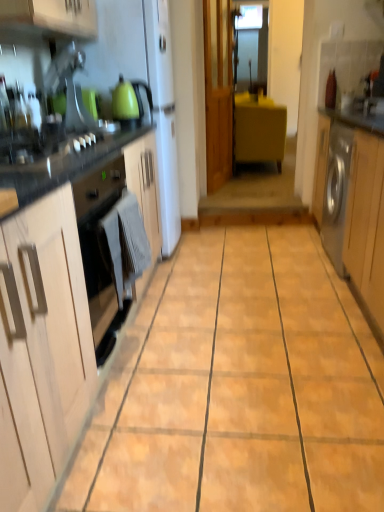
What do you see at coordinates (259, 129) in the screenshot?
I see `yellow matte cabinet at center, which ranks as the 3th cabinetry in front-to-back order` at bounding box center [259, 129].

Where is `silver metallic washing machine at right, the second cabinetry viewed from the back`? This screenshot has height=512, width=384. silver metallic washing machine at right, the second cabinetry viewed from the back is located at coordinates (353, 203).

What do you see at coordinates (124, 101) in the screenshot?
I see `matte green kettle at upper left` at bounding box center [124, 101].

You are a GUI agent. You are given a task and a screenshot of the screen. Output one action in this format:
    pyautogui.click(x=<x>, y=<y>)
    Task: Click on the light wood cabinet at left, the third cabinetry viewed from the right
    
    Given the screenshot: What is the action you would take?
    pyautogui.click(x=42, y=348)

Find the location of a particular element. yellow matte cabinet at center, which is the 1th cabinetry from top to bottom is located at coordinates (259, 129).

Does point (127, 102) come farther from viewer compared to point (377, 245)?

That is True.

From a real-world perspective, is matte green kettle at upper left above or below silver metallic washing machine at right, the 2th cabinetry ordered from the bottom?

matte green kettle at upper left is above silver metallic washing machine at right, the 2th cabinetry ordered from the bottom.

Can you confirm if matte green kettle at upper left is positioned to the left of silver metallic washing machine at right, the 2th cabinetry ordered from the bottom?

Yes, matte green kettle at upper left is to the left of silver metallic washing machine at right, the 2th cabinetry ordered from the bottom.

Does matte green kettle at upper left contain silver metallic washing machine at right, which is counted as the first cabinetry, starting from the right?

No, matte green kettle at upper left does not contain silver metallic washing machine at right, which is counted as the first cabinetry, starting from the right.

Does matte green kettle at upper left have a larger size compared to light wood cabinet at left, the third cabinetry positioned from the back?

No.

Consider the image. Would you say matte green kettle at upper left contains light wood cabinet at left, which appears as the first cabinetry when ordered from the bottom?

That's incorrect, light wood cabinet at left, which appears as the first cabinetry when ordered from the bottom, is not inside matte green kettle at upper left.

How many degrees apart are the facing directions of matte green kettle at upper left and light wood cabinet at left, marked as the third cabinetry in a top-to-bottom arrangement?

The angular difference between matte green kettle at upper left and light wood cabinet at left, marked as the third cabinetry in a top-to-bottom arrangement, is 2.98 degrees.

Looking at their sizes, would you say silver metallic washing machine at right, which is counted as the first cabinetry, starting from the right, is wider or thinner than gray fabric towel at lower left?

Clearly, silver metallic washing machine at right, which is counted as the first cabinetry, starting from the right, has more width compared to gray fabric towel at lower left.

From a real-world perspective, which object stands above the other?

gray fabric towel at lower left.

Are silver metallic washing machine at right, the 2th cabinetry in the front-to-back sequence, and gray fabric towel at lower left located far from each other?

Absolutely, silver metallic washing machine at right, the 2th cabinetry in the front-to-back sequence, is distant from gray fabric towel at lower left.

Locate an element on the screen. kitchen appliance lying on the right of light wood cabinet at left, which appears as the first cabinetry when ordered from the bottom is located at coordinates (124, 101).

Considering the positions of point (32, 307) and point (121, 106), is point (32, 307) closer or farther from the camera than point (121, 106)?

Point (32, 307).

From a real-world perspective, is light wood cabinet at left, which is the 1th cabinetry from left to right, above or below matte green kettle at upper left?

From a real-world perspective, light wood cabinet at left, which is the 1th cabinetry from left to right, is physically below matte green kettle at upper left.

Considering the sizes of objects light wood cabinet at left, which appears as the first cabinetry when ordered from the bottom, and matte green kettle at upper left in the image provided, who is taller, light wood cabinet at left, which appears as the first cabinetry when ordered from the bottom, or matte green kettle at upper left?

Standing taller between the two is light wood cabinet at left, which appears as the first cabinetry when ordered from the bottom.

Is gray fabric towel at lower left at the back of matte green kettle at upper left?

No.

Is matte green kettle at upper left further to the viewer compared to gray fabric towel at lower left?

Yes, it is.

In the scene shown: Is matte green kettle at upper left with gray fabric towel at lower left?

No, matte green kettle at upper left is not making contact with gray fabric towel at lower left.

Does silver metallic washing machine at right, which is counted as the first cabinetry, starting from the right, touch yellow matte cabinet at center, which is the 1th cabinetry from top to bottom?

No, silver metallic washing machine at right, which is counted as the first cabinetry, starting from the right, is not in contact with yellow matte cabinet at center, which is the 1th cabinetry from top to bottom.

Is yellow matte cabinet at center, which ranks as the 3th cabinetry in front-to-back order, surrounded by silver metallic washing machine at right, the 2th cabinetry when ordered from top to bottom?

Definitely not — yellow matte cabinet at center, which ranks as the 3th cabinetry in front-to-back order, is not inside silver metallic washing machine at right, the 2th cabinetry when ordered from top to bottom.

From their relative heights in the image, would you say silver metallic washing machine at right, the 2th cabinetry when ordered from top to bottom, is taller or shorter than yellow matte cabinet at center, which is the 1th cabinetry from top to bottom?

Considering their sizes, silver metallic washing machine at right, the 2th cabinetry when ordered from top to bottom, has more height than yellow matte cabinet at center, which is the 1th cabinetry from top to bottom.

Does silver metallic washing machine at right, the 2th cabinetry when ordered from top to bottom, appear on the left side of yellow matte cabinet at center, which ranks as the 3th cabinetry in front-to-back order?

In fact, silver metallic washing machine at right, the 2th cabinetry when ordered from top to bottom, is to the right of yellow matte cabinet at center, which ranks as the 3th cabinetry in front-to-back order.

From the image's perspective, would you say silver metallic washing machine at right, the 2th cabinetry in the front-to-back sequence, is shown under matte green kettle at upper left?

Yes.

Looking at this image, measure the distance between silver metallic washing machine at right, the second cabinetry viewed from the back, and matte green kettle at upper left.

They are 4.46 feet apart.

In the image, is silver metallic washing machine at right, the 2th cabinetry when ordered from top to bottom, positioned in front of or behind matte green kettle at upper left?

Visually, silver metallic washing machine at right, the 2th cabinetry when ordered from top to bottom, is located in front of matte green kettle at upper left.

Between silver metallic washing machine at right, the second cabinetry viewed from the back, and matte green kettle at upper left, which one has larger width?

With larger width is silver metallic washing machine at right, the second cabinetry viewed from the back.

Find the location of a particular element. the 2nd cabinetry to the right when counting from the matte green kettle at upper left is located at coordinates (353, 203).

In order to click on the 2nd cabinetry below the matte green kettle at upper left (from the image's perspective) in this screenshot , I will do `click(42, 348)`.

Estimate the real-world distances between objects in this image. Which object is further from silver metallic washing machine at right, the 2th cabinetry when ordered from top to bottom, matte green kettle at upper left or yellow matte cabinet at center, acting as the second cabinetry starting from the right?

yellow matte cabinet at center, acting as the second cabinetry starting from the right, lies further to silver metallic washing machine at right, the 2th cabinetry when ordered from top to bottom, than the other object.

From the image, which object appears to be nearer to matte green kettle at upper left, light wood cabinet at left, which is the 1th cabinetry from left to right, or gray fabric towel at lower left?

gray fabric towel at lower left.

Consider the image. Based on their spatial positions, is silver metallic washing machine at right, the 2th cabinetry when ordered from top to bottom, or matte green kettle at upper left closer to gray fabric towel at lower left?

matte green kettle at upper left is positioned closer to the anchor gray fabric towel at lower left.

Based on their spatial positions, is gray fabric towel at lower left or matte green kettle at upper left closer to silver metallic washing machine at right, the 2th cabinetry ordered from the bottom?

gray fabric towel at lower left is closer to silver metallic washing machine at right, the 2th cabinetry ordered from the bottom.

Considering their positions, is light wood cabinet at left, which is the 1th cabinetry from left to right, positioned further to silver metallic washing machine at right, the 2th cabinetry when ordered from top to bottom, than matte green kettle at upper left?

light wood cabinet at left, which is the 1th cabinetry from left to right, is positioned further to the anchor silver metallic washing machine at right, the 2th cabinetry when ordered from top to bottom.

When comparing their distances from light wood cabinet at left, which appears as the first cabinetry when ordered from the bottom, does yellow matte cabinet at center, marked as the second cabinetry in a left-to-right arrangement, or matte green kettle at upper left seem closer?

matte green kettle at upper left is closer to light wood cabinet at left, which appears as the first cabinetry when ordered from the bottom.

Estimate the real-world distances between objects in this image. Which object is further from matte green kettle at upper left, silver metallic washing machine at right, the second cabinetry viewed from the back, or light wood cabinet at left, which appears as the 1th cabinetry when viewed from the front?

light wood cabinet at left, which appears as the 1th cabinetry when viewed from the front, is further to matte green kettle at upper left.

From the image, which object appears to be farther from silver metallic washing machine at right, the 2th cabinetry when ordered from top to bottom, matte green kettle at upper left or gray fabric towel at lower left?

matte green kettle at upper left is further to silver metallic washing machine at right, the 2th cabinetry when ordered from top to bottom.

Image resolution: width=384 pixels, height=512 pixels. What are the coordinates of `cabinetry located between light wood cabinet at left, the third cabinetry viewed from the right, and matte green kettle at upper left in the depth direction` in the screenshot? It's located at (353, 203).

At what (x,y) coordinates should I click in order to perform the action: click on kitchen appliance located between light wood cabinet at left, which is the 1th cabinetry from left to right, and yellow matte cabinet at center, which is the 1th cabinetry from top to bottom, in the depth direction. Please return your answer as a coordinate pair (x, y). Image resolution: width=384 pixels, height=512 pixels. Looking at the image, I should click on (124, 101).

The image size is (384, 512). What are the coordinates of `laundry between light wood cabinet at left, which appears as the 1th cabinetry when viewed from the front, and silver metallic washing machine at right, the second cabinetry viewed from the back, from left to right` in the screenshot? It's located at (124, 244).

At what (x,y) coordinates should I click in order to perform the action: click on kitchen appliance between silver metallic washing machine at right, the 2th cabinetry when ordered from top to bottom, and yellow matte cabinet at center, acting as the second cabinetry starting from the right, along the z-axis. Please return your answer as a coordinate pair (x, y). The width and height of the screenshot is (384, 512). Looking at the image, I should click on (124, 101).